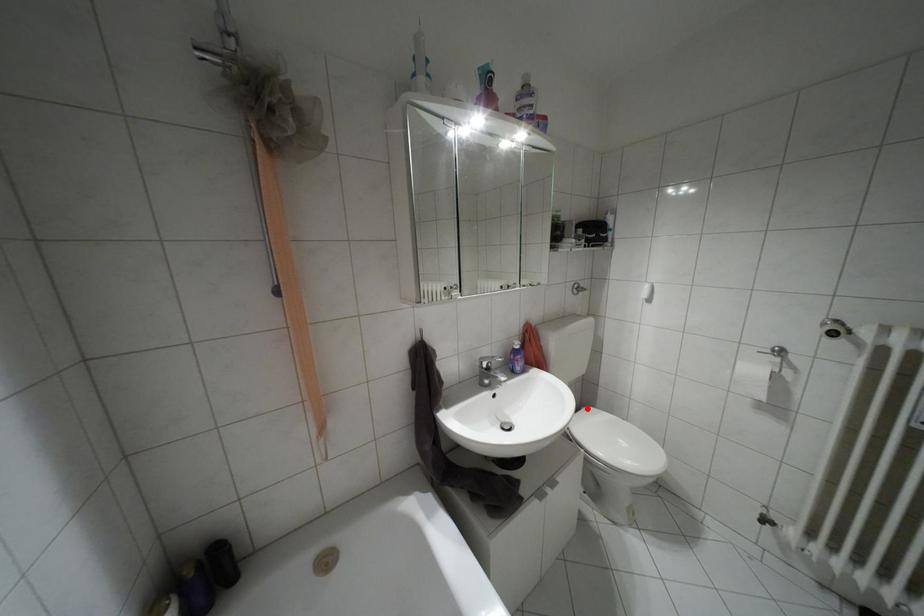
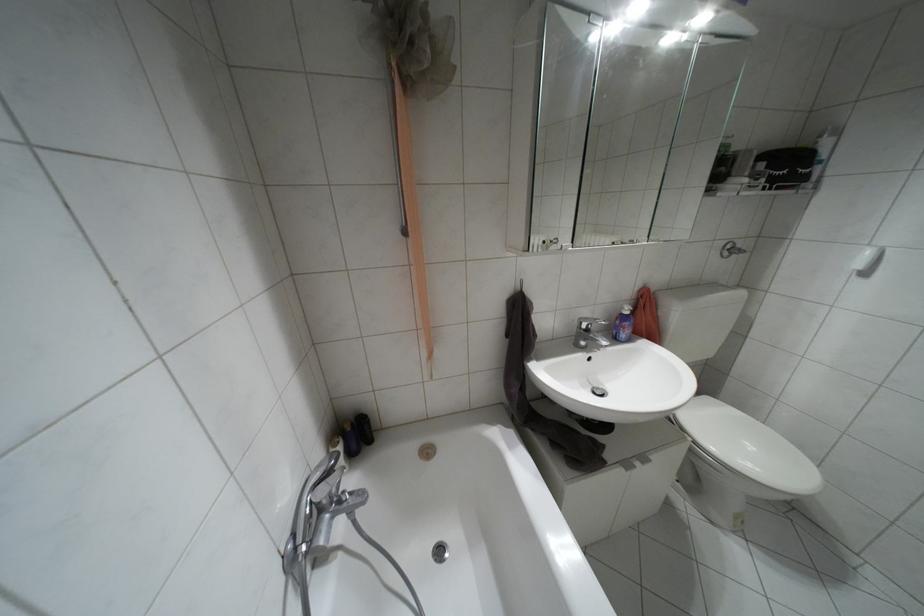
Question: I am providing you with two images of the same scene from different viewpoints. Given a red point in image1, look at the same physical point in image2. Is it:

Choices:
 (A) Closer to the viewpoint
 (B) Farther from the viewpoint

Answer: (A)